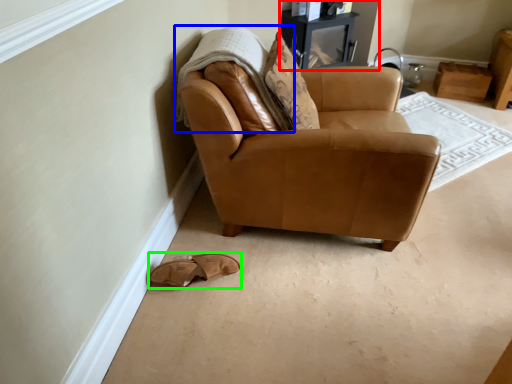
Question: Considering the real-world distances, which object is closest to entertainment center (highlighted by a red box)? blanket (highlighted by a blue box) or footwear (highlighted by a green box).

Choices:
 (A) blanket
 (B) footwear

Answer: (A)